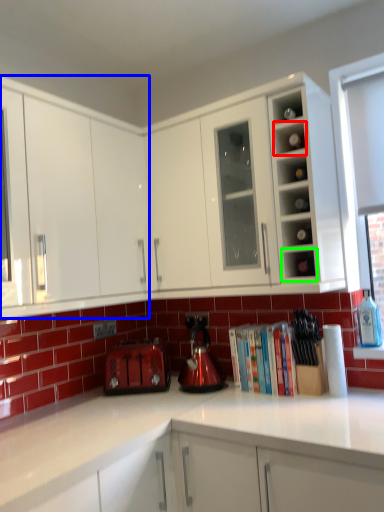
Question: Based on their relative distances, which object is farther from shelf (highlighted by a red box)? Choose from cabinetry (highlighted by a blue box) and shelf (highlighted by a green box).

Choices:
 (A) cabinetry
 (B) shelf

Answer: (A)